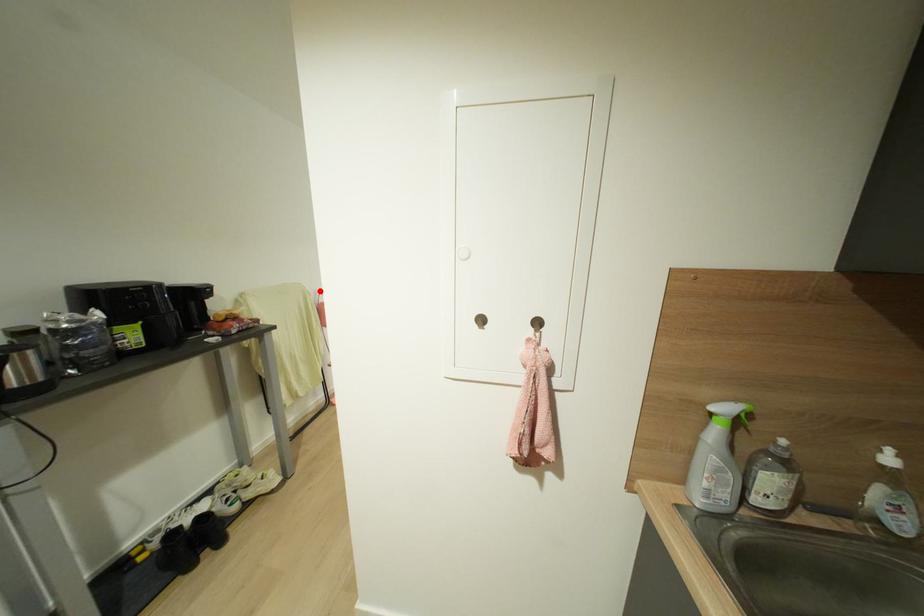
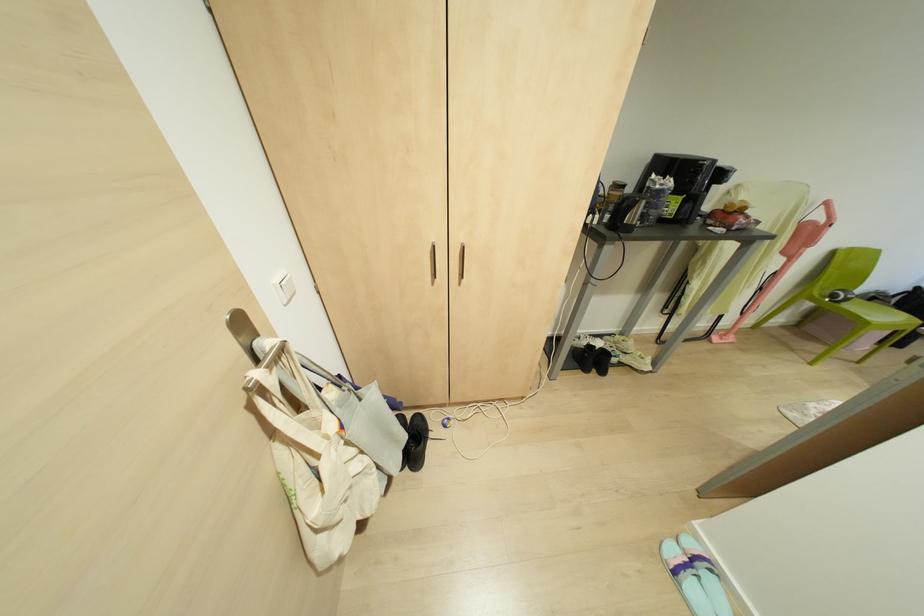
Find the pixel in the second image that matches the highlighted location in the first image.

(825, 203)